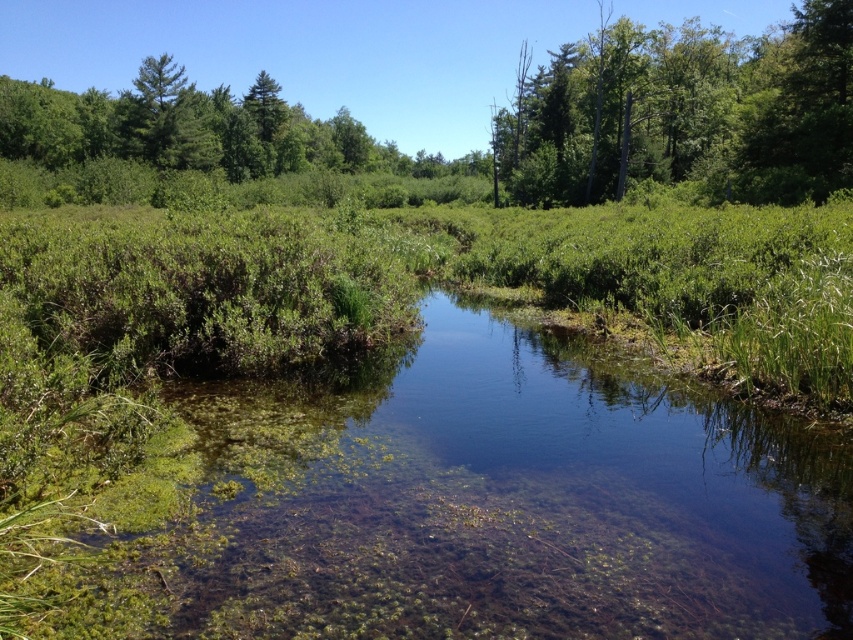
Question: Which point is farther from the camera taking this photo?

Choices:
 (A) (712, 429)
 (B) (741, 115)

Answer: (B)

Question: Does green algae-covered water at center appear under green leafy trees at upper center?

Choices:
 (A) no
 (B) yes

Answer: (B)

Question: Can you confirm if green algae-covered water at center is positioned to the left of green leafy trees at upper center?

Choices:
 (A) yes
 (B) no

Answer: (A)

Question: Which point is closer to the camera?

Choices:
 (A) green algae-covered water at center
 (B) green leafy trees at upper center

Answer: (A)

Question: Is green algae-covered water at center thinner than green leafy trees at upper center?

Choices:
 (A) yes
 (B) no

Answer: (A)